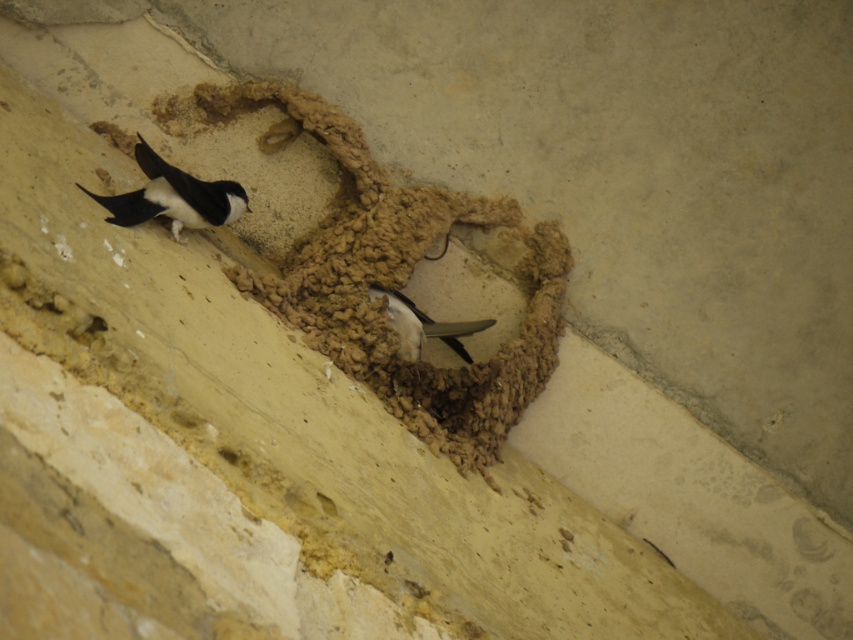
You are standing 2 meters away from a swallow nest on a wall. You notice a specific point marked at coordinates point (105, 220). Can you reach this point with your hand without moving closer than your current position?

The point (105, 220) is 1.98 meters from the viewer. Since you are standing 2 meters away, you can reach it with your hand without moving closer.

What are the coordinates of the black glossy swallow at upper left in the image?

The coordinates of the black glossy swallow at upper left are at point (173, 196).

You are a birdwatcher observing the swallow nest. You notice two birds nearby. Which one is smaller in width between the black glossy swallow at upper left and the white glossy bird at center?

The black glossy swallow at upper left has a lesser width compared to the white glossy bird at center, so the black glossy swallow at upper left is smaller in width.